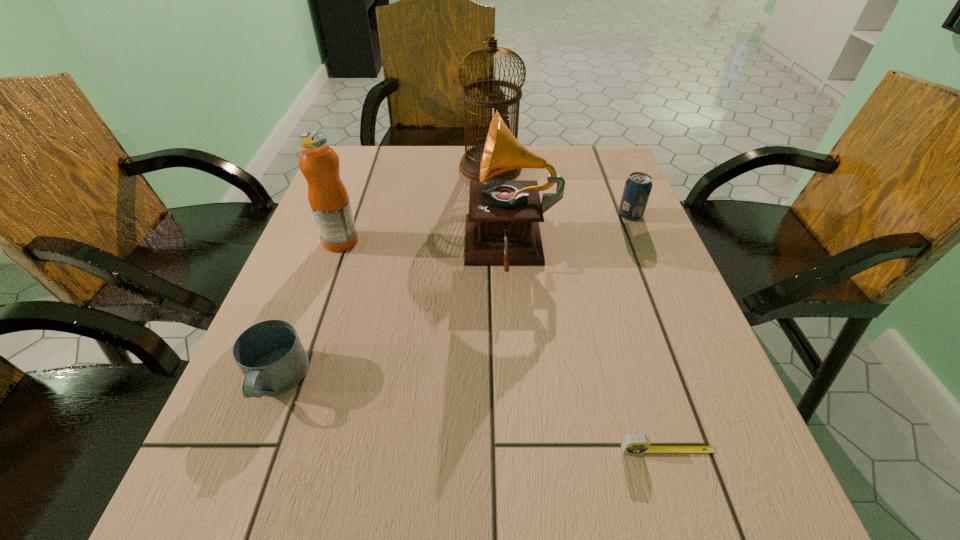
What are the coordinates of `free space located 0.210m on the front-facing side of the birdcage` in the screenshot? It's located at click(x=386, y=167).

Identify the location of free region located on the horn of the phonograph record. (341, 250).

Locate an element on the screen. vacant space located 0.050m on the horn of the phonograph record is located at coordinates (443, 250).

The width and height of the screenshot is (960, 540). Identify the location of free space located on the horn of the phonograph record. (323, 250).

At what (x,y) coordinates should I click in order to perform the action: click on vacant space located 0.370m on the back of the fourth shortest object. Please return your answer as a coordinate pair (x, y). The height and width of the screenshot is (540, 960). Looking at the image, I should click on (372, 153).

Where is `vacant space located 0.070m on the left of the pop soda`? This screenshot has height=540, width=960. vacant space located 0.070m on the left of the pop soda is located at coordinates (589, 215).

Identify the location of free space located on the side of the mug with the handle. Image resolution: width=960 pixels, height=540 pixels. (232, 494).

Locate an element on the screen. The image size is (960, 540). free location located at the front of the nearest object with the tape extended is located at coordinates (683, 497).

The image size is (960, 540). I want to click on object positioned at the far edge, so click(469, 165).

Where is `fruit juice present at the left edge`? The width and height of the screenshot is (960, 540). fruit juice present at the left edge is located at coordinates (328, 197).